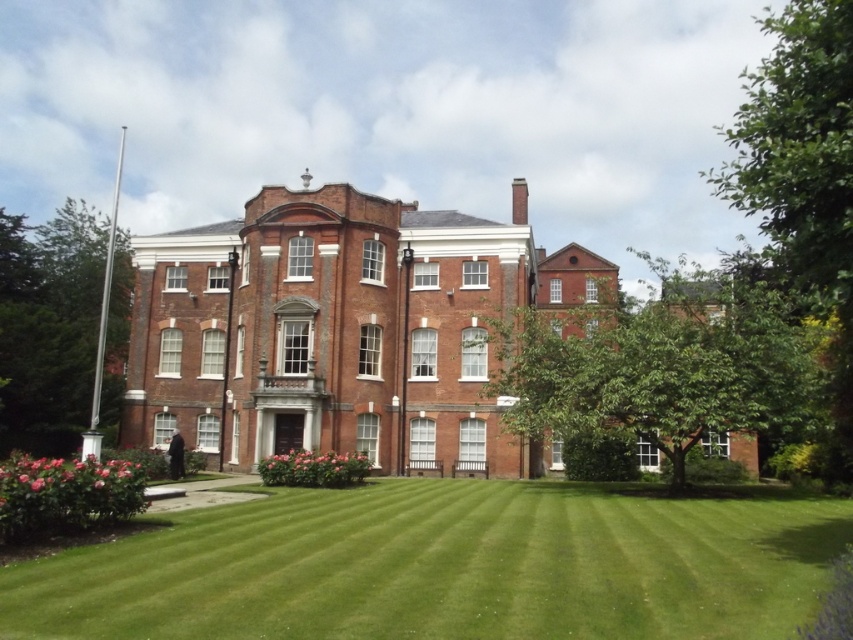
Between point (219, 433) and point (688, 390), which one is positioned behind?

The point (219, 433) is behind.

Consider the image. Is brick mansion at center thinner than green leafy tree at center?

No, brick mansion at center is not thinner than green leafy tree at center.

Is point (393, 376) farther from camera compared to point (752, 394)?

That is True.

You are a GUI agent. You are given a task and a screenshot of the screen. Output one action in this format:
    pyautogui.click(x=<x>, y=<y>)
    Task: Click on the brick mansion at center
    The width and height of the screenshot is (853, 640).
    Given the screenshot: What is the action you would take?
    pyautogui.click(x=339, y=328)

Based on the photo, is green leafy tree at left below pink glossy roses at lower left?

Actually, green leafy tree at left is above pink glossy roses at lower left.

Is green leafy tree at left to the right of pink glossy roses at lower left from the viewer's perspective?

No, green leafy tree at left is not to the right of pink glossy roses at lower left.

Where is `green leafy tree at left`? Image resolution: width=853 pixels, height=640 pixels. green leafy tree at left is located at coordinates (48, 326).

Does green leafy tree at center lie in front of pink matte flowers at lower center?

Yes, green leafy tree at center is in front of pink matte flowers at lower center.

Is point (747, 356) positioned before point (299, 451)?

That is True.

Locate an element on the screen. This screenshot has height=640, width=853. green leafy tree at center is located at coordinates (662, 362).